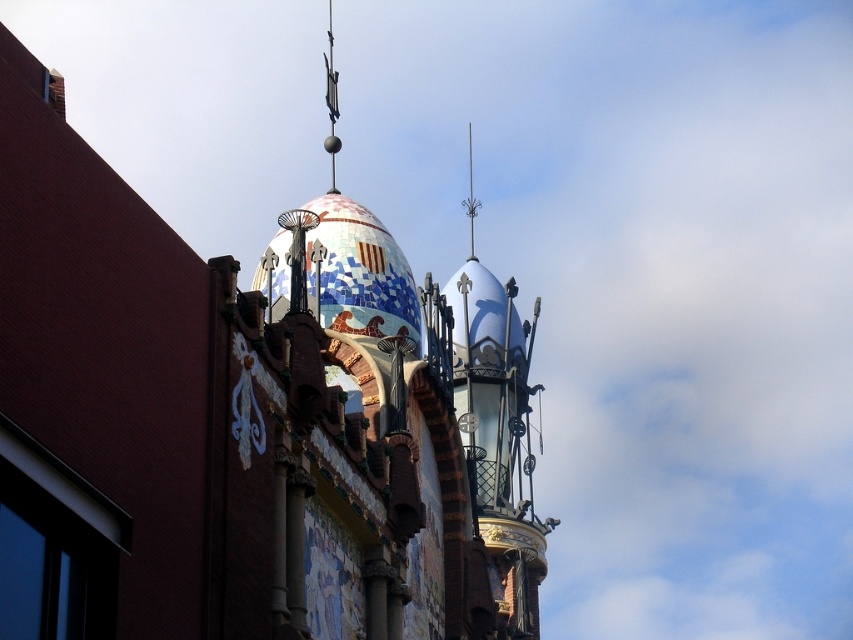
Question: Which object is closer to the camera taking this photo?

Choices:
 (A) white glossy dome at upper center
 (B) metallic silver spire at upper center
 (C) mosaic tile dome at center
 (D) metallic spire at upper center

Answer: (C)

Question: Estimate the real-world distances between objects in this image. Which object is farther from the mosaic tile dome at center?

Choices:
 (A) white glossy dome at upper center
 (B) metallic spire at upper center

Answer: (B)

Question: Is white glossy dome at upper center smaller than metallic spire at upper center?

Choices:
 (A) no
 (B) yes

Answer: (B)

Question: Does white glossy dome at upper center come behind metallic silver spire at upper center?

Choices:
 (A) no
 (B) yes

Answer: (A)

Question: Can you confirm if white glossy dome at upper center is thinner than mosaic tile dome at center?

Choices:
 (A) no
 (B) yes

Answer: (B)

Question: Which is farther from the white glossy dome at upper center?

Choices:
 (A) metallic silver spire at upper center
 (B) mosaic tile dome at center

Answer: (A)